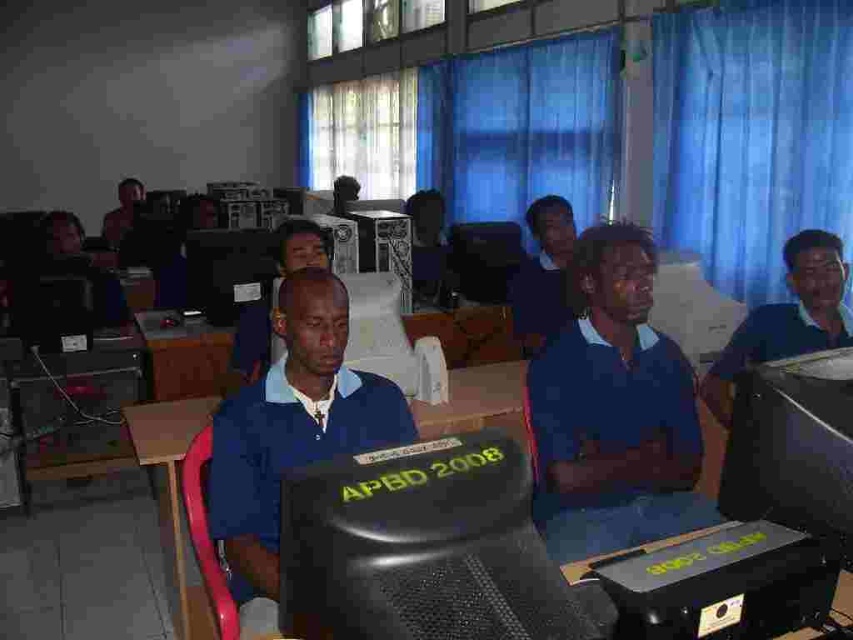
Is blue shirt at center further to camera compared to matte black monitor at center?

No.

Is blue shirt at center smaller than matte black monitor at center?

No, blue shirt at center is not smaller than matte black monitor at center.

Who is more distant from viewer, (548, 285) or (225, 272)?

Point (225, 272)

What are the coordinates of `blue shirt at center` in the screenshot? It's located at (543, 273).

Locate an element on the screen. wooden table at center is located at coordinates (173, 497).

Who is more distant from viewer, (212, 630) or (236, 280)?

The point (236, 280) is behind.

Between point (177, 579) and point (245, 266), which one is positioned in front?

Point (177, 579) is more forward.

Image resolution: width=853 pixels, height=640 pixels. In order to click on wooden table at center in this screenshot , I will do `click(173, 497)`.

Which is below, blue fabric shirt at center or blue shirt at center?

blue fabric shirt at center is lower down.

Which is behind, point (233, 467) or point (523, 337)?

The point (523, 337) is more distant.

Which is in front, point (254, 490) or point (563, 288)?

Point (254, 490)

Image resolution: width=853 pixels, height=640 pixels. Identify the location of blue fabric shirt at center. (292, 428).